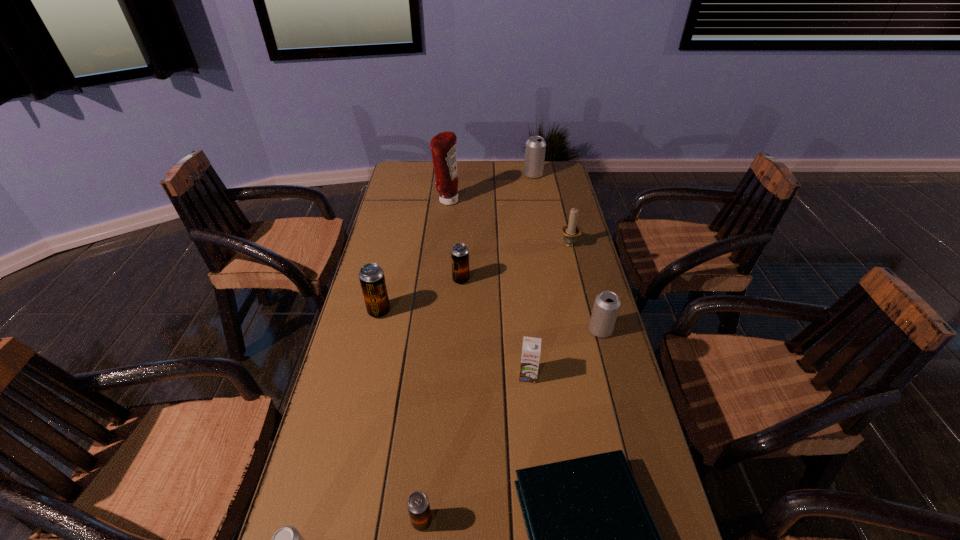
You are a GUI agent. You are given a task and a screenshot of the screen. Output one action in this format:
    pyautogui.click(x=<x>, y=<y>)
    Task: Click on the second smallest black beer can
    Image resolution: width=960 pixels, height=540 pixels.
    Given the screenshot: What is the action you would take?
    [459, 253]

Locate an element on the screen. the rightmost white beer can is located at coordinates (606, 306).

Identify the location of the fourth farthest beer can. The image size is (960, 540). (606, 306).

Locate an element on the screen. This screenshot has height=540, width=960. the fifth farthest beer can is located at coordinates (418, 505).

This screenshot has height=540, width=960. In order to click on the nearest black beer can in this screenshot , I will do `click(418, 505)`.

Locate an element on the screen. This screenshot has width=960, height=540. blank area located 0.050m on the left of the ninth nearest object is located at coordinates (422, 201).

This screenshot has height=540, width=960. I want to click on vacant area situated 0.150m on the front of the farthest white beer can, so click(538, 199).

I want to click on free space located 0.260m on the front of the third farthest beer can, so click(359, 397).

At what (x,y) coordinates should I click in order to perform the action: click on vacant space located on the handle side of the eighth nearest object. Please return your answer as a coordinate pair (x, y). Looking at the image, I should click on (555, 187).

Where is `blank area located on the handle side of the eighth nearest object`? The width and height of the screenshot is (960, 540). blank area located on the handle side of the eighth nearest object is located at coordinates (561, 210).